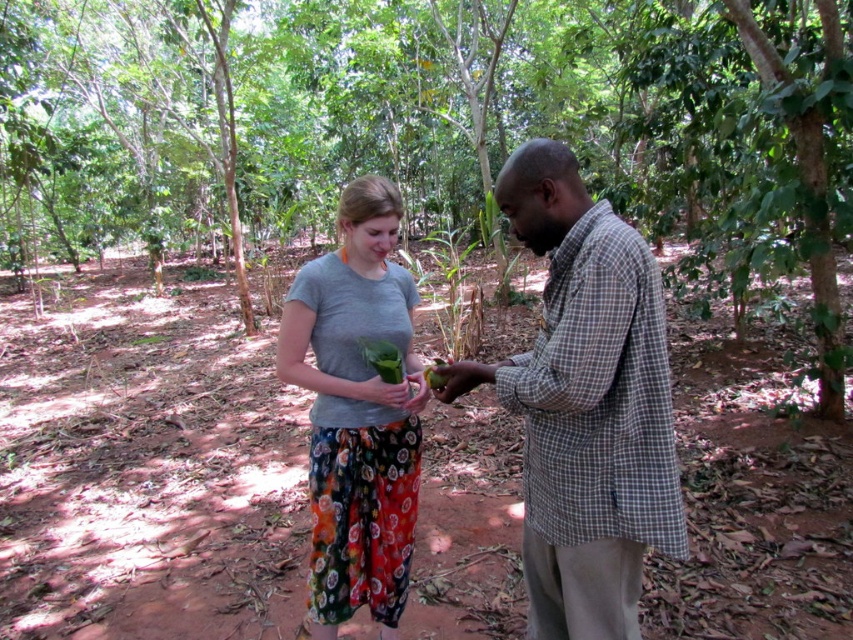
Between point (563, 262) and point (436, 371), which one is positioned behind?

The point (436, 371) is more distant.

Where is `gray checkered shirt at center`? The width and height of the screenshot is (853, 640). gray checkered shirt at center is located at coordinates [x=585, y=404].

Locate an element on the screen. The width and height of the screenshot is (853, 640). gray checkered shirt at center is located at coordinates (585, 404).

Which is more to the left, gray cotton t-shirt at center or green leafy vegetable at center?

gray cotton t-shirt at center

Is gray cotton t-shirt at center further to the viewer compared to green leafy vegetable at center?

Yes.

You are a GUI agent. You are given a task and a screenshot of the screen. Output one action in this format:
    pyautogui.click(x=<x>, y=<y>)
    Task: Click on the gray cotton t-shirt at center
    The width and height of the screenshot is (853, 640).
    Given the screenshot: What is the action you would take?
    pyautogui.click(x=357, y=412)

Which is behind, point (26, 104) or point (408, 550)?

The point (26, 104) is behind.

Which is in front, point (244, 157) or point (312, 444)?

Point (312, 444) is in front.

In order to click on green leafy tree at center in this screenshot , I will do `click(434, 129)`.